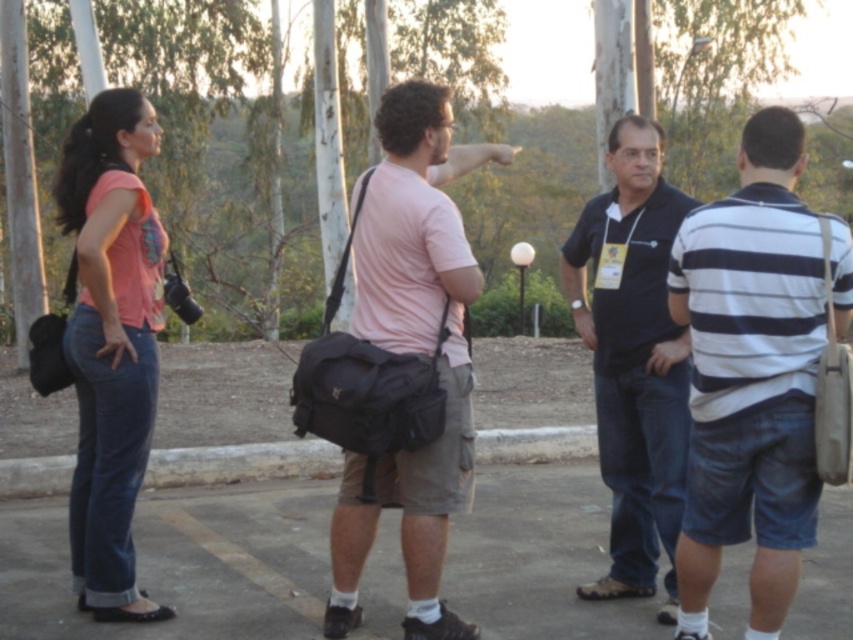
You are a photographer trying to capture a group photo of the white striped shirt at right and the matte pink shirt at left. Since you want to include both subjects in the frame, which direction should you position yourself relative to the subjects to ensure both are visible?

To capture both the white striped shirt at right and the matte pink shirt at left in the frame, you should position yourself below the matte pink shirt at left, as the white striped shirt at right is located below it. This positioning allows you to see both subjects simultaneously.